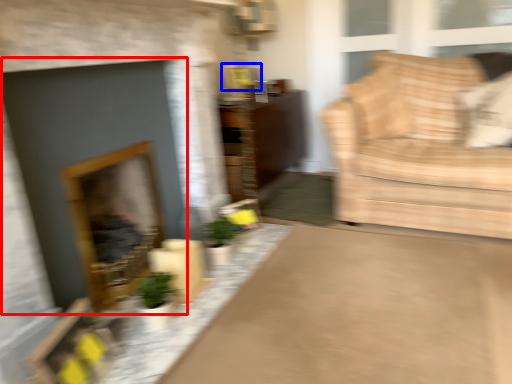
Question: Among these objects, which one is farthest to the camera, fireplace (highlighted by a red box) or picture frame (highlighted by a blue box)?

Choices:
 (A) fireplace
 (B) picture frame

Answer: (B)